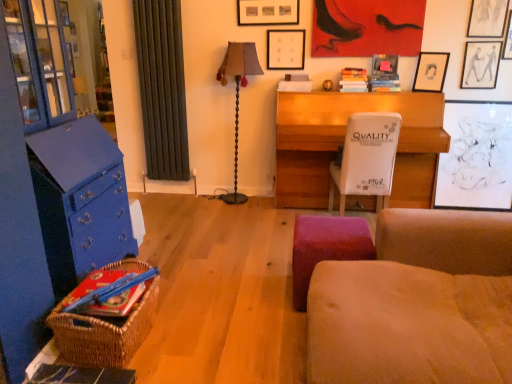
Question: Does woven brown picnic basket at lower left have a larger size compared to velvet purple stool at lower center?

Choices:
 (A) no
 (B) yes

Answer: (A)

Question: Is woven brown picnic basket at lower left aimed at velvet purple stool at lower center?

Choices:
 (A) no
 (B) yes

Answer: (B)

Question: Is woven brown picnic basket at lower left closer to the viewer compared to velvet purple stool at lower center?

Choices:
 (A) yes
 (B) no

Answer: (A)

Question: Can you confirm if woven brown picnic basket at lower left is positioned to the left of velvet purple stool at lower center?

Choices:
 (A) yes
 (B) no

Answer: (A)

Question: From a real-world perspective, is woven brown picnic basket at lower left on top of velvet purple stool at lower center?

Choices:
 (A) no
 (B) yes

Answer: (A)

Question: Is hardcover book at lower left, placed as the 3th book when sorted from right to left, situated inside matte black picture frame at upper center, which is the 4th picture frame from right to left, or outside?

Choices:
 (A) inside
 (B) outside

Answer: (B)

Question: In terms of size, does hardcover book at lower left, placed as the 3th book when sorted from right to left, appear bigger or smaller than matte black picture frame at upper center, which is the 4th picture frame from right to left?

Choices:
 (A) big
 (B) small

Answer: (A)

Question: From a real-world perspective, is hardcover book at lower left, placed as the 3th book when sorted from right to left, positioned above or below matte black picture frame at upper center, the third picture frame in the left-to-right sequence?

Choices:
 (A) above
 (B) below

Answer: (B)

Question: Is point (119, 281) positioned closer to the camera than point (384, 64)?

Choices:
 (A) closer
 (B) farther

Answer: (A)

Question: From the image's perspective, is hardcover book at upper right, which is the third book from front to back, positioned above or below matte black picture frame at upper center, the third picture frame in the left-to-right sequence?

Choices:
 (A) above
 (B) below

Answer: (B)

Question: Is point (356, 87) positioned closer to the camera than point (389, 66)?

Choices:
 (A) closer
 (B) farther

Answer: (A)

Question: In terms of width, does hardcover book at upper right, arranged as the 2th book when viewed from the right, look wider or thinner when compared to matte black picture frame at upper center, the third picture frame in the left-to-right sequence?

Choices:
 (A) wide
 (B) thin

Answer: (A)

Question: Based on their sizes in the image, would you say hardcover book at upper right, which ranks as the 1th book in back-to-front order, is bigger or smaller than matte black picture frame at upper center, which is the 4th picture frame from right to left?

Choices:
 (A) small
 (B) big

Answer: (B)

Question: Is brown fabric lamp at center in front of or behind suede-like beige studio couch at lower right in the image?

Choices:
 (A) front
 (B) behind

Answer: (B)

Question: Is brown fabric lamp at center inside the boundaries of suede-like beige studio couch at lower right, or outside?

Choices:
 (A) outside
 (B) inside

Answer: (A)